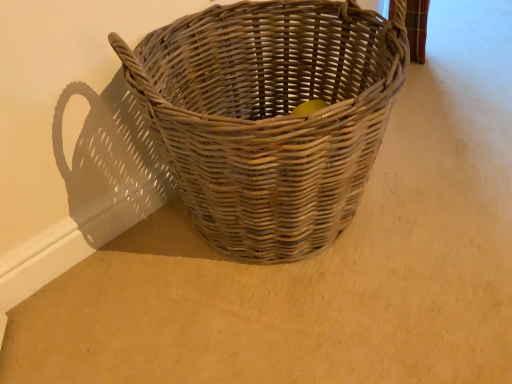
Locate an element on the screen. The image size is (512, 384). natural wicker basket at center is located at coordinates (269, 116).

The width and height of the screenshot is (512, 384). What do you see at coordinates (269, 116) in the screenshot? I see `natural wicker basket at center` at bounding box center [269, 116].

In order to face natural wicker basket at center, should I rotate leftwards or rightwards?

To face it directly, rotate right by 2.747 degrees.

The height and width of the screenshot is (384, 512). What are the coordinates of `natural wicker basket at center` in the screenshot? It's located at tap(269, 116).